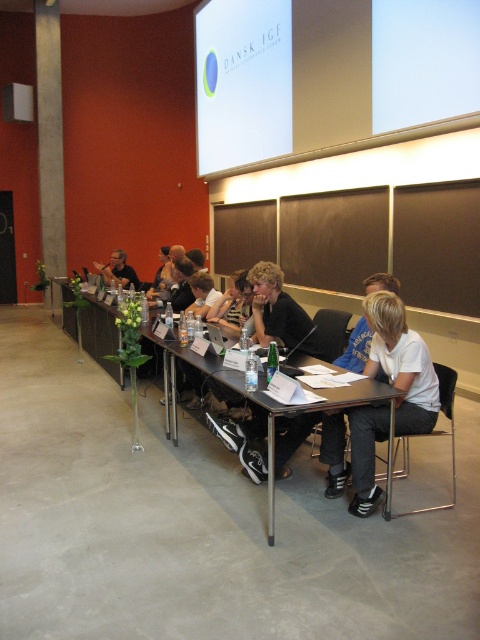
Based on the photo, can you confirm if white glossy projection screen at upper center is thinner than matte black shirt at center?

No, white glossy projection screen at upper center is not thinner than matte black shirt at center.

Between white glossy projection screen at upper center and matte black shirt at center, which one appears on the right side from the viewer's perspective?

From the viewer's perspective, white glossy projection screen at upper center appears more on the right side.

The image size is (480, 640). I want to click on white glossy projection screen at upper center, so click(x=242, y=83).

The height and width of the screenshot is (640, 480). What are the coordinates of `white matte projection screen at upper center` in the screenshot? It's located at (423, 61).

Who is positioned more to the right, white matte projection screen at upper center or black plastic table at center?

From the viewer's perspective, white matte projection screen at upper center appears more on the right side.

Identify the location of white matte projection screen at upper center. This screenshot has width=480, height=640. pos(423,61).

This screenshot has width=480, height=640. Identify the location of white matte projection screen at upper center. (423, 61).

Is white glossy projection screen at upper center below white matte shirt at center?

No, white glossy projection screen at upper center is not below white matte shirt at center.

You are a GUI agent. You are given a task and a screenshot of the screen. Output one action in this format:
    pyautogui.click(x=<x>, y=<y>)
    Task: Click on the white glossy projection screen at upper center
    The height and width of the screenshot is (640, 480).
    Given the screenshot: What is the action you would take?
    pyautogui.click(x=242, y=83)

At what (x,y) coordinates should I click in order to perform the action: click on white glossy projection screen at upper center. Please return your answer as a coordinate pair (x, y). Image resolution: width=480 pixels, height=640 pixels. Looking at the image, I should click on (242, 83).

This screenshot has height=640, width=480. I want to click on white glossy projection screen at upper center, so click(242, 83).